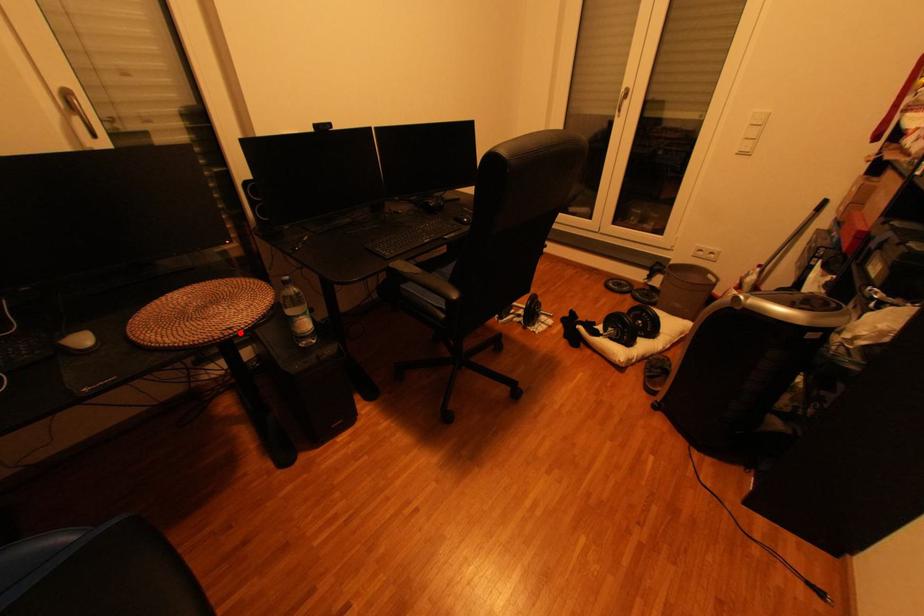
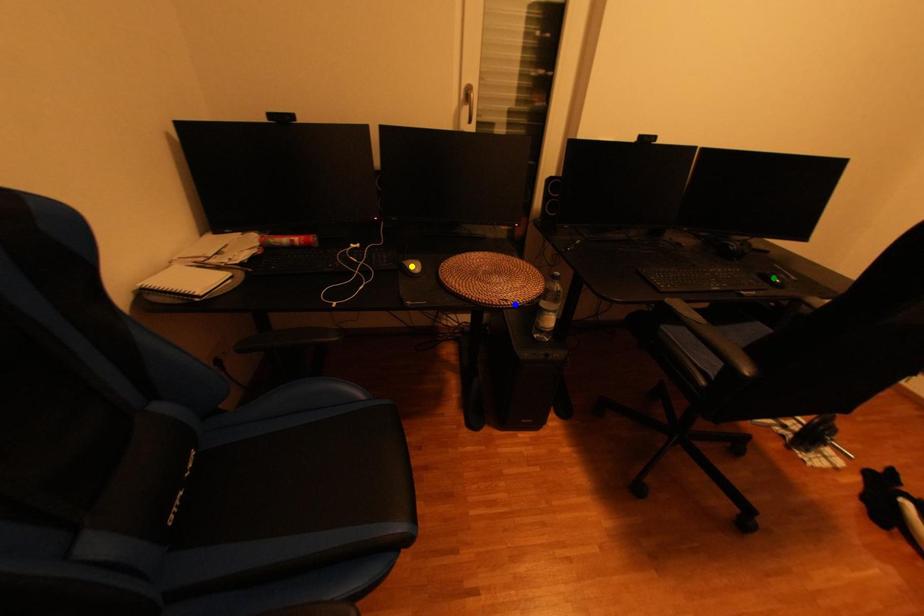
Question: I am providing you with two images of the same scene from different viewpoints. A red point is marked on the first image. You are given multiple points on the second image. Which point in image 2 represents the same 3d spot as the red point in image 1?

Choices:
 (A) blue point
 (B) green point
 (C) yellow point

Answer: (A)